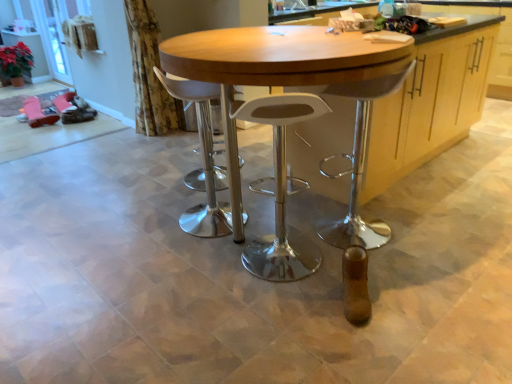
Question: Is floral fabric curtain at upper left facing away from wooden table at center?

Choices:
 (A) no
 (B) yes

Answer: (A)

Question: Is the depth of floral fabric curtain at upper left greater than that of wooden table at center?

Choices:
 (A) yes
 (B) no

Answer: (A)

Question: Is floral fabric curtain at upper left at the right side of wooden table at center?

Choices:
 (A) yes
 (B) no

Answer: (B)

Question: Is floral fabric curtain at upper left oriented towards wooden table at center?

Choices:
 (A) yes
 (B) no

Answer: (A)

Question: Would you consider floral fabric curtain at upper left to be distant from wooden table at center?

Choices:
 (A) yes
 (B) no

Answer: (A)

Question: Is wooden table at center taller or shorter than clear glass screen door at upper left?

Choices:
 (A) short
 (B) tall

Answer: (A)

Question: Based on their positions, is wooden table at center located to the left or right of clear glass screen door at upper left?

Choices:
 (A) left
 (B) right

Answer: (B)

Question: From a real-world perspective, is wooden table at center physically located above or below clear glass screen door at upper left?

Choices:
 (A) below
 (B) above

Answer: (A)

Question: Is wooden table at center wider or thinner than clear glass screen door at upper left?

Choices:
 (A) thin
 (B) wide

Answer: (B)

Question: Considering the positions of point (58, 64) and point (163, 77), is point (58, 64) closer or farther from the camera than point (163, 77)?

Choices:
 (A) closer
 (B) farther

Answer: (B)

Question: Considering the positions of clear glass screen door at upper left and white plastic stool at center, marked as the 1th stool in a left-to-right arrangement, in the image, is clear glass screen door at upper left taller or shorter than white plastic stool at center, marked as the 1th stool in a left-to-right arrangement,?

Choices:
 (A) short
 (B) tall

Answer: (B)

Question: Which is correct: clear glass screen door at upper left is inside white plastic stool at center, arranged as the second stool when viewed from the right, or outside of it?

Choices:
 (A) inside
 (B) outside

Answer: (B)

Question: Is clear glass screen door at upper left wider or thinner than white plastic stool at center, arranged as the second stool when viewed from the right?

Choices:
 (A) thin
 (B) wide

Answer: (A)

Question: From a real-world perspective, is white plastic stool at center, arranged as the second stool when viewed from the right, positioned above or below clear glass screen door at upper left?

Choices:
 (A) above
 (B) below

Answer: (B)

Question: Do you think white plastic stool at center, arranged as the second stool when viewed from the right, is within clear glass screen door at upper left, or outside of it?

Choices:
 (A) inside
 (B) outside

Answer: (B)